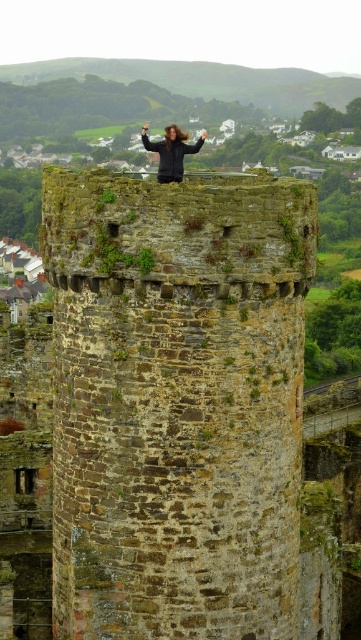
Is brown stone tower at center bigger than dark brown hair at top?

No, brown stone tower at center is not bigger than dark brown hair at top.

Where is `brown stone tower at center`? brown stone tower at center is located at coordinates (176, 403).

This screenshot has width=361, height=640. In order to click on brown stone tower at center in this screenshot , I will do `click(176, 403)`.